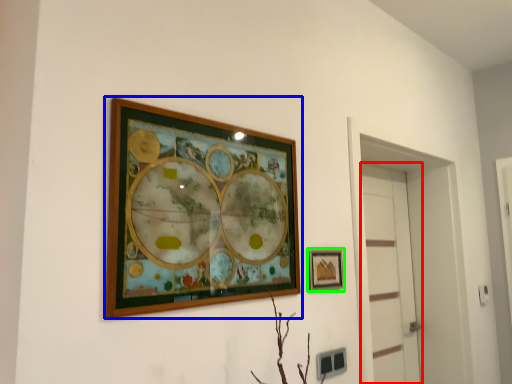
Question: Considering the real-world distances, which object is closest to door (highlighted by a red box)? picture frame (highlighted by a blue box) or picture frame (highlighted by a green box).

Choices:
 (A) picture frame
 (B) picture frame

Answer: (B)